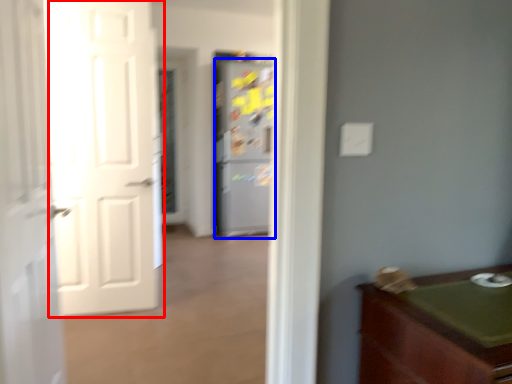
Question: Which of the following is the farthest to the observer, door (highlighted by a red box) or refrigerator (highlighted by a blue box)?

Choices:
 (A) door
 (B) refrigerator

Answer: (B)